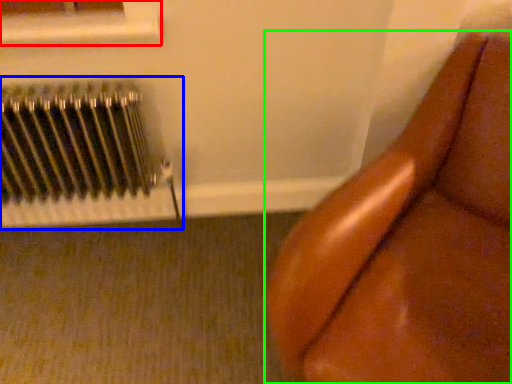
Question: Which object is the closest to the window frame (highlighted by a red box)? Choose among these: radiator (highlighted by a blue box) or furniture (highlighted by a green box).

Choices:
 (A) radiator
 (B) furniture

Answer: (A)